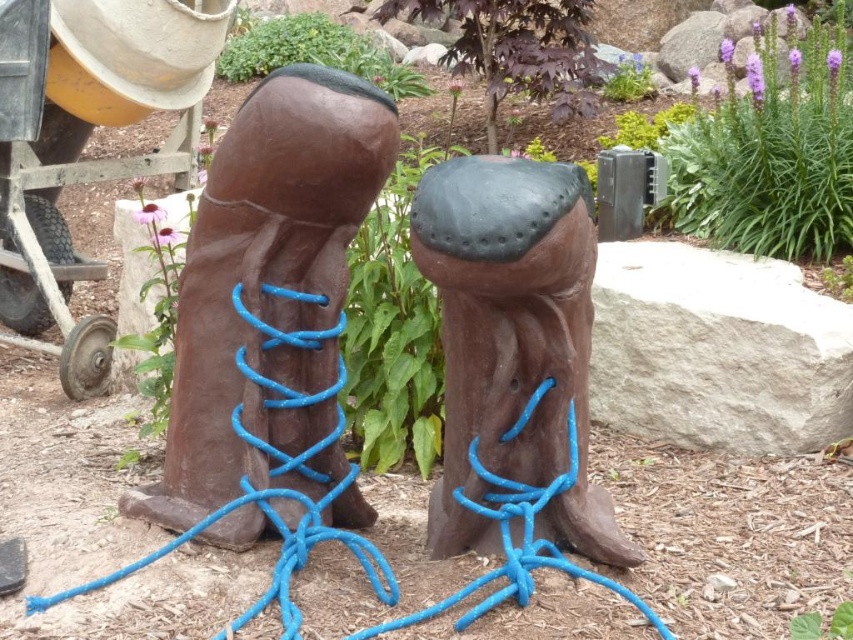
Is brown wood boot at center in front of brown matte wood at center?

A: No, it is behind brown matte wood at center.

Which is more to the left, brown wood boot at center or brown matte wood at center?

Positioned to the left is brown wood boot at center.

The height and width of the screenshot is (640, 853). I want to click on brown wood boot at center, so click(x=265, y=282).

Where is `brown wood boot at center`? Image resolution: width=853 pixels, height=640 pixels. brown wood boot at center is located at coordinates (265, 282).